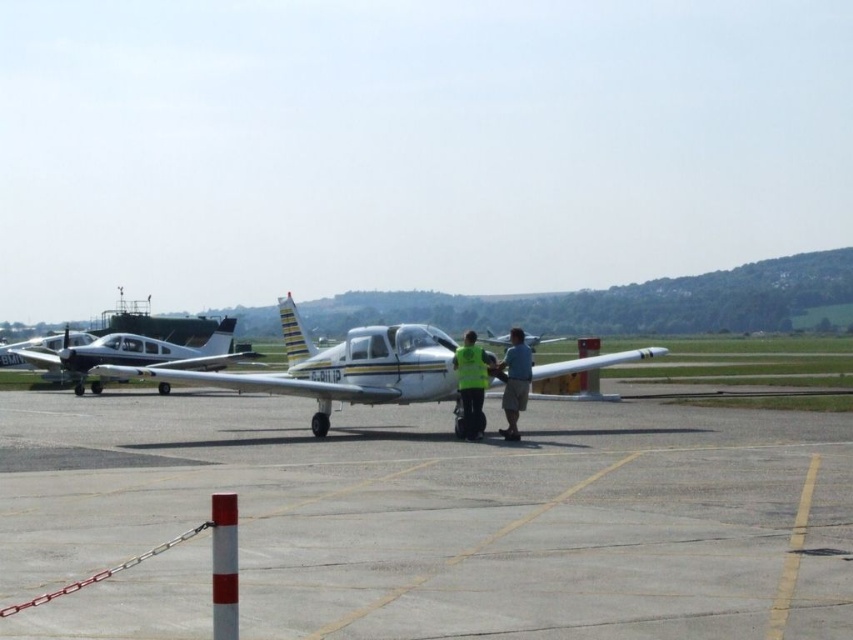
Question: Is smooth asphalt tarmac at center below high visibility yellow jacket at center?

Choices:
 (A) no
 (B) yes

Answer: (B)

Question: Can you confirm if smooth asphalt tarmac at center is positioned to the right of high visibility yellow jacket at center?

Choices:
 (A) no
 (B) yes

Answer: (A)

Question: Which is farther from the white glossy airplane at left?

Choices:
 (A) white glossy airplane at center
 (B) blue fabric shirt at center
 (C) smooth asphalt tarmac at center

Answer: (B)

Question: Estimate the real-world distances between objects in this image. Which object is closer to the white glossy airplane at center?

Choices:
 (A) blue fabric shirt at center
 (B) white glossy airplane at left
 (C) smooth asphalt tarmac at center

Answer: (B)

Question: Is high visibility yellow jacket at center to the right of blue fabric shirt at center from the viewer's perspective?

Choices:
 (A) no
 (B) yes

Answer: (A)

Question: Which object is positioned farthest from the smooth asphalt tarmac at center?

Choices:
 (A) white glossy airplane at left
 (B) blue fabric shirt at center
 (C) high visibility yellow jacket at center

Answer: (A)